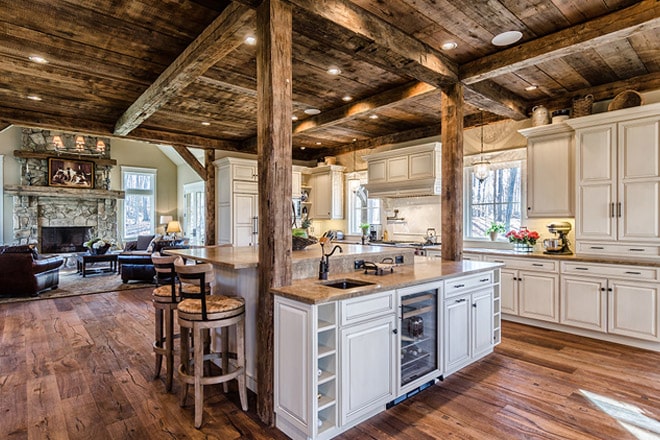
Locate an element on the screen. The height and width of the screenshot is (440, 660). fireplace is located at coordinates (70, 242).